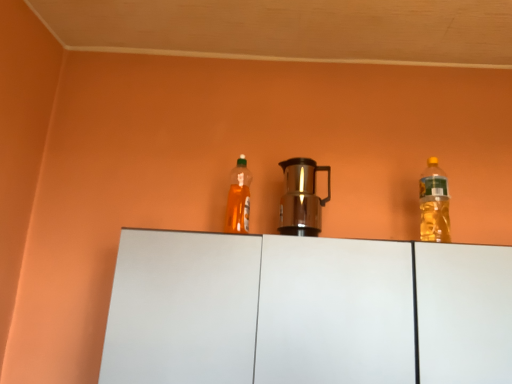
Question: Is translucent orange bottle at center, placed as the 2th bottle when sorted from right to left, completely or partially outside of shiny metallic coffee pot at center?

Choices:
 (A) yes
 (B) no

Answer: (A)

Question: Is translucent orange bottle at center, which is counted as the 1th bottle, starting from the left, positioned in front of shiny metallic coffee pot at center?

Choices:
 (A) no
 (B) yes

Answer: (A)

Question: Can you confirm if translucent orange bottle at center, placed as the 2th bottle when sorted from right to left, is thinner than shiny metallic coffee pot at center?

Choices:
 (A) yes
 (B) no

Answer: (A)

Question: From a real-world perspective, is translucent orange bottle at center, placed as the 2th bottle when sorted from right to left, below shiny metallic coffee pot at center?

Choices:
 (A) no
 (B) yes

Answer: (A)

Question: Is shiny metallic coffee pot at center completely or partially inside translucent orange bottle at center, which is counted as the 1th bottle, starting from the left?

Choices:
 (A) no
 (B) yes

Answer: (A)

Question: From the image's perspective, is translucent orange bottle at center, placed as the 2th bottle when sorted from right to left, over shiny metallic coffee pot at center?

Choices:
 (A) yes
 (B) no

Answer: (A)

Question: Would you consider white matte cabinet at center to be distant from translucent orange bottle at center, placed as the 2th bottle when sorted from right to left?

Choices:
 (A) no
 (B) yes

Answer: (A)

Question: From a real-world perspective, is white matte cabinet at center located beneath translucent orange bottle at center, which is counted as the 1th bottle, starting from the left?

Choices:
 (A) yes
 (B) no

Answer: (A)

Question: Is white matte cabinet at center closer to camera compared to translucent orange bottle at center, which is counted as the 1th bottle, starting from the left?

Choices:
 (A) no
 (B) yes

Answer: (B)

Question: Is white matte cabinet at center placed right next to translucent orange bottle at center, which is counted as the 1th bottle, starting from the left?

Choices:
 (A) yes
 (B) no

Answer: (B)

Question: From a real-world perspective, does white matte cabinet at center stand above translucent orange bottle at center, which is counted as the 1th bottle, starting from the left?

Choices:
 (A) yes
 (B) no

Answer: (B)

Question: From the image's perspective, does white matte cabinet at center appear higher than translucent orange bottle at center, placed as the 2th bottle when sorted from right to left?

Choices:
 (A) yes
 (B) no

Answer: (B)

Question: Considering the relative sizes of translucent yellow bottle at right, the 2th bottle in the left-to-right sequence, and shiny metallic coffee pot at center in the image provided, is translucent yellow bottle at right, the 2th bottle in the left-to-right sequence, taller than shiny metallic coffee pot at center?

Choices:
 (A) no
 (B) yes

Answer: (B)